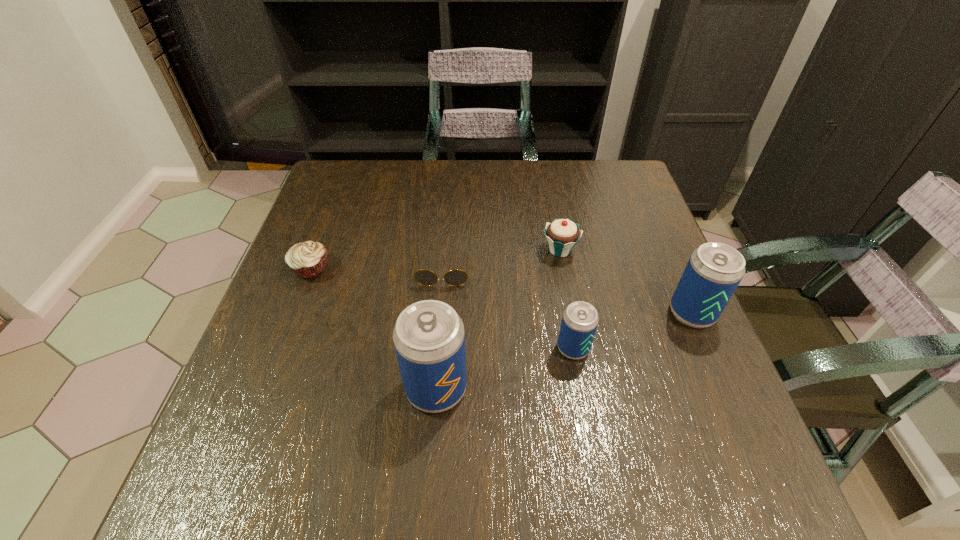
At what (x,y) coordinates should I click in order to perform the action: click on the nearest object. Please return your answer as a coordinate pair (x, y). The width and height of the screenshot is (960, 540). Looking at the image, I should click on (429, 338).

Locate an element on the screen. The width and height of the screenshot is (960, 540). the leftmost beer can is located at coordinates (429, 338).

I want to click on the third tallest object, so click(580, 319).

Where is `the second beer can from left to right`? This screenshot has height=540, width=960. the second beer can from left to right is located at coordinates (580, 319).

You are a GUI agent. You are given a task and a screenshot of the screen. Output one action in this format:
    pyautogui.click(x=<x>, y=<y>)
    Task: Click on the fourth farthest object
    The height and width of the screenshot is (540, 960).
    Given the screenshot: What is the action you would take?
    pyautogui.click(x=714, y=270)

The image size is (960, 540). In order to click on the rightmost object in this screenshot , I will do `click(714, 270)`.

At what (x,y) coordinates should I click in order to perform the action: click on the fourth tallest object. Please return your answer as a coordinate pair (x, y). The height and width of the screenshot is (540, 960). Looking at the image, I should click on [562, 234].

This screenshot has height=540, width=960. What are the coordinates of `the shortest object` in the screenshot? It's located at (456, 277).

I want to click on muffin, so click(308, 259).

This screenshot has width=960, height=540. I want to click on the second shortest object, so click(308, 259).